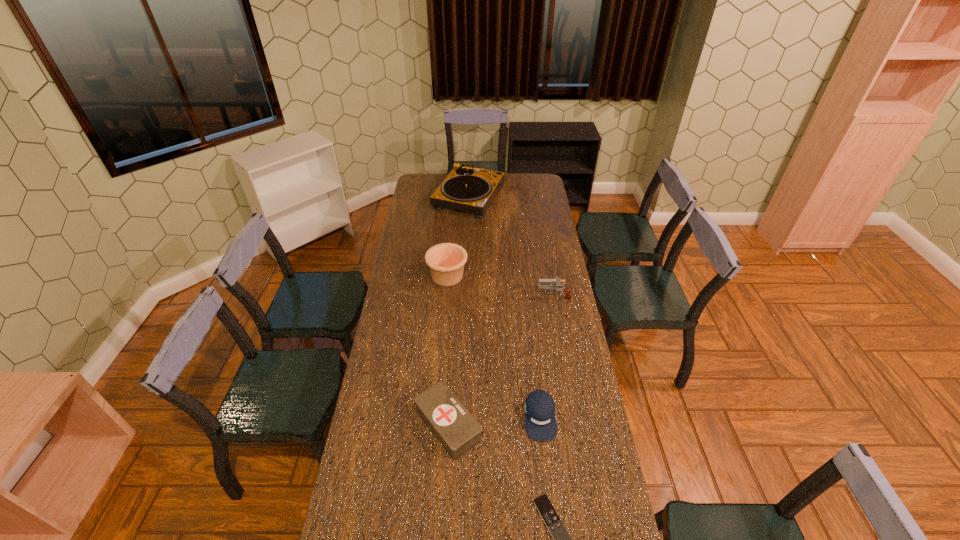
Locate an element on the screen. The image size is (960, 540). the farthest object is located at coordinates (468, 189).

You are a GUI agent. You are given a task and a screenshot of the screen. Output one action in this format:
    pyautogui.click(x=<x>, y=<y>)
    Task: Click on the pottery
    This screenshot has height=540, width=960.
    Given the screenshot: What is the action you would take?
    pyautogui.click(x=446, y=261)

Find the location of a particular element. gun is located at coordinates (558, 283).

Identify the location of the first-aid kit. (455, 428).

At what (x,y) coordinates should I click in order to perform the action: click on baseball cap. Please return your answer as a coordinate pair (x, y). Looking at the image, I should click on (540, 422).

This screenshot has height=540, width=960. What are the coordinates of `vacant space situated 0.240m on the right of the farthest object` in the screenshot? It's located at (545, 197).

At what (x,y) coordinates should I click in order to perform the action: click on free spot located on the right of the pottery. Please return your answer as a coordinate pair (x, y). The height and width of the screenshot is (540, 960). Looking at the image, I should click on (543, 276).

Locate an element on the screen. vacant space located at the barrel end of the gun is located at coordinates (486, 295).

Image resolution: width=960 pixels, height=540 pixels. I want to click on vacant area located at the barrel end of the gun, so click(483, 295).

You are a GUI agent. You are given a task and a screenshot of the screen. Output one action in this format:
    pyautogui.click(x=<x>, y=<y>)
    Task: Click on the vacant space situated 0.360m at the barrel end of the gun
    The width and height of the screenshot is (960, 540).
    Given the screenshot: What is the action you would take?
    pyautogui.click(x=460, y=295)